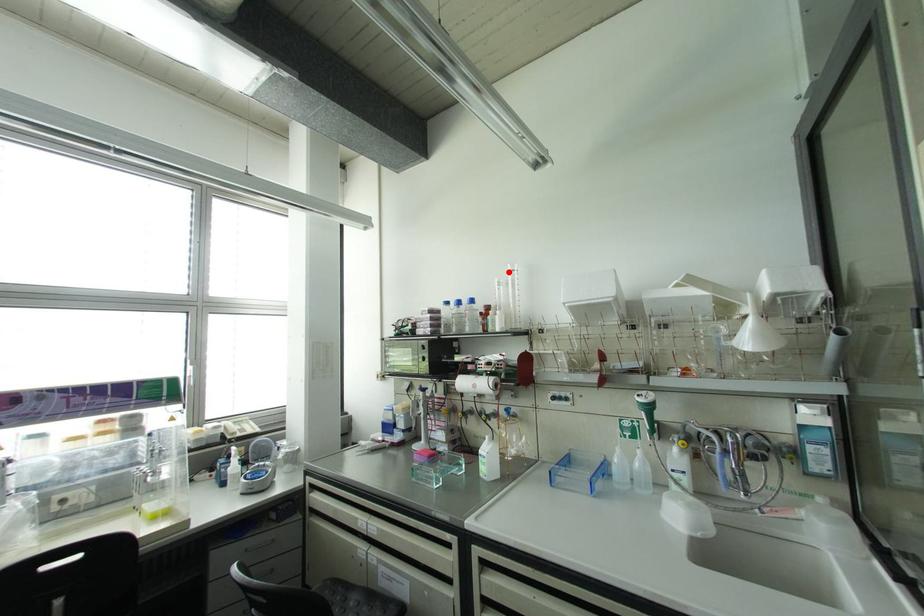
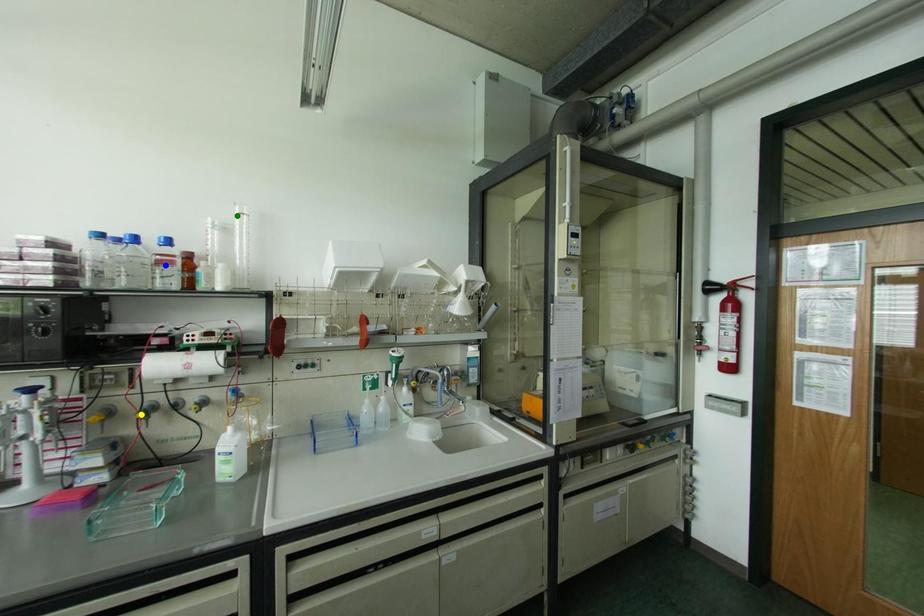
Question: I am providing you with two images of the same scene from different viewpoints. A red point is marked on the first image. You are given multiple points on the second image. Which point in image 2 is actually the same real-world point as the red point in image 1?

Choices:
 (A) yellow point
 (B) blue point
 (C) green point

Answer: (C)